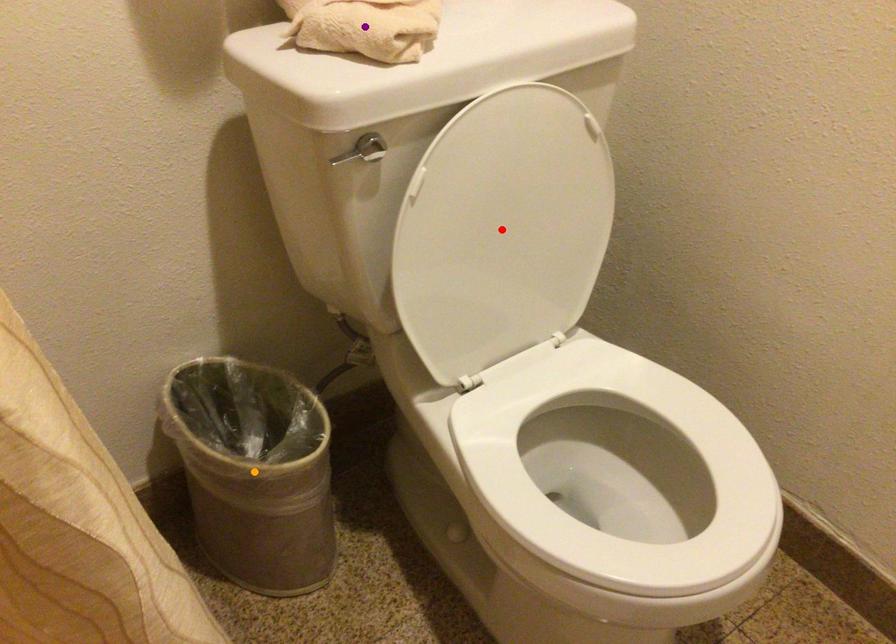
Order these from nearest to farthest:
purple point, red point, orange point

1. orange point
2. red point
3. purple point